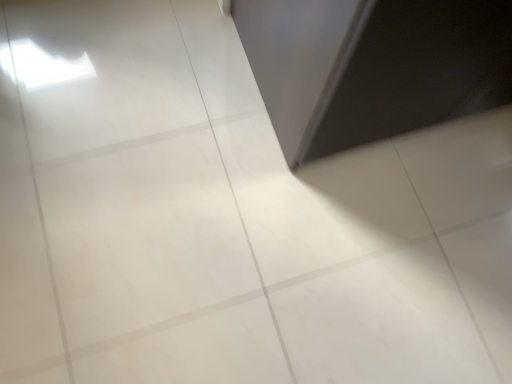
Identify the location of free location to the left of matte gray door at upper right. The image size is (512, 384). (146, 105).